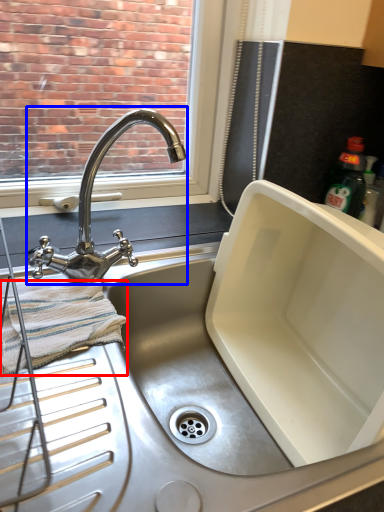
Question: Which of the following is the closest to the observer, bath towel (highlighted by a red box) or tap (highlighted by a blue box)?

Choices:
 (A) bath towel
 (B) tap

Answer: (B)